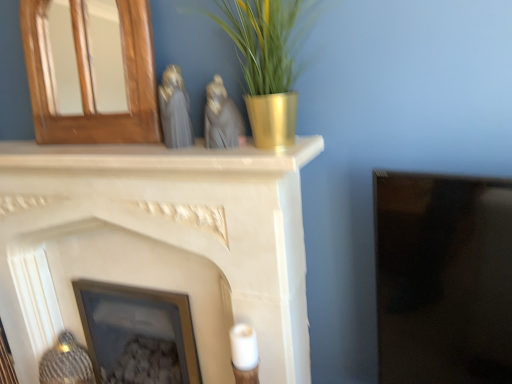
Question: From the image's perspective, is wooden mirror at upper left, the 2th fireplace ordered from the bottom, below matte gray statue at center, which is the 1th animal in right-to-left order?

Choices:
 (A) no
 (B) yes

Answer: (A)

Question: Are wooden mirror at upper left, which appears as the 1th fireplace when viewed from the top, and matte gray statue at center, which is the 1th animal in right-to-left order, located far from each other?

Choices:
 (A) no
 (B) yes

Answer: (A)

Question: From a real-world perspective, is wooden mirror at upper left, which appears as the 1th fireplace when viewed from the top, positioned under matte gray statue at center, which is the 1th animal in right-to-left order, based on gravity?

Choices:
 (A) yes
 (B) no

Answer: (B)

Question: Considering the relative sizes of wooden mirror at upper left, the 2th fireplace ordered from the bottom, and matte gray statue at center, the 2th animal positioned from the left, in the image provided, is wooden mirror at upper left, the 2th fireplace ordered from the bottom, shorter than matte gray statue at center, the 2th animal positioned from the left,?

Choices:
 (A) yes
 (B) no

Answer: (B)

Question: Is wooden mirror at upper left, the 2th fireplace ordered from the bottom, surrounding matte gray statue at center, which is the 1th animal in right-to-left order?

Choices:
 (A) no
 (B) yes

Answer: (A)

Question: Choose the correct answer: Is wooden mirror at upper left, the 2th fireplace ordered from the bottom, inside white matte fireplace at center, placed as the first fireplace when sorted from bottom to top, or outside it?

Choices:
 (A) inside
 (B) outside

Answer: (B)

Question: Is wooden mirror at upper left, which appears as the 1th fireplace when viewed from the top, in front of or behind white matte fireplace at center, placed as the first fireplace when sorted from bottom to top, in the image?

Choices:
 (A) behind
 (B) front

Answer: (A)

Question: Visually, is wooden mirror at upper left, which appears as the 1th fireplace when viewed from the top, positioned to the left or to the right of white matte fireplace at center, placed as the first fireplace when sorted from bottom to top?

Choices:
 (A) left
 (B) right

Answer: (A)

Question: Looking at their shapes, would you say wooden mirror at upper left, the 2th fireplace ordered from the bottom, is wider or thinner than white matte fireplace at center, which is counted as the second fireplace, starting from the top?

Choices:
 (A) wide
 (B) thin

Answer: (B)

Question: Which is correct: satin gray statue at center, which appears as the 2th animal when viewed from the right, is inside white matte fireplace at center, placed as the first fireplace when sorted from bottom to top, or outside of it?

Choices:
 (A) outside
 (B) inside

Answer: (A)

Question: In terms of size, does satin gray statue at center, the 1th animal in the left-to-right sequence, appear bigger or smaller than white matte fireplace at center, placed as the first fireplace when sorted from bottom to top?

Choices:
 (A) big
 (B) small

Answer: (B)

Question: In the image, is satin gray statue at center, which appears as the 2th animal when viewed from the right, on the left side or the right side of white matte fireplace at center, which is counted as the second fireplace, starting from the top?

Choices:
 (A) left
 (B) right

Answer: (B)

Question: Is satin gray statue at center, the 1th animal in the left-to-right sequence, in front of or behind white matte fireplace at center, placed as the first fireplace when sorted from bottom to top, in the image?

Choices:
 (A) behind
 (B) front

Answer: (A)

Question: From a real-world perspective, is matte gray statue at center, which is the 1th animal in right-to-left order, physically located above or below satin gray statue at center, which appears as the 2th animal when viewed from the right?

Choices:
 (A) below
 (B) above

Answer: (A)

Question: Based on their sizes in the image, would you say matte gray statue at center, the 2th animal positioned from the left, is bigger or smaller than satin gray statue at center, which appears as the 2th animal when viewed from the right?

Choices:
 (A) big
 (B) small

Answer: (A)